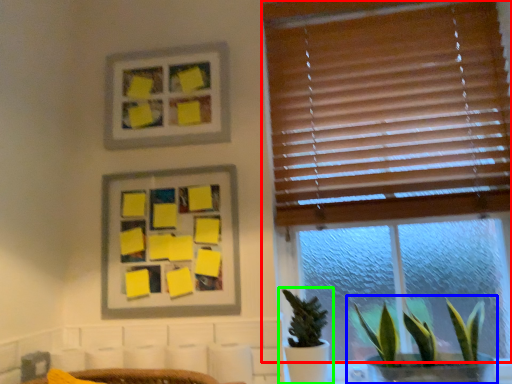
Question: Which is nearer to the window (highlighted by a red box)? houseplant (highlighted by a blue box) or houseplant (highlighted by a green box).

Choices:
 (A) houseplant
 (B) houseplant

Answer: (A)